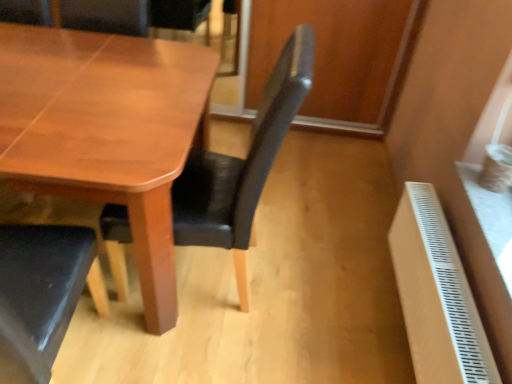
Identify the location of vacant space to the left of white plastic radiator at lower right. click(303, 322).